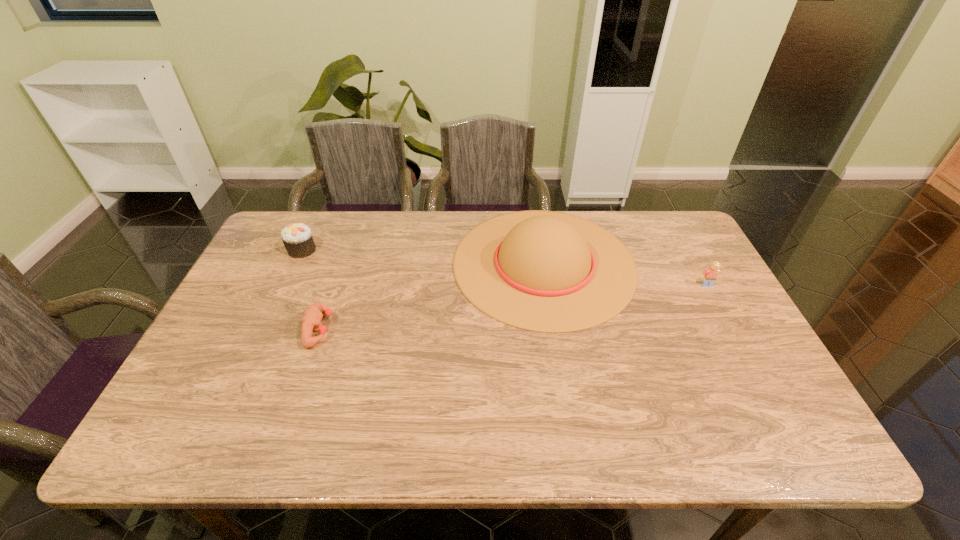
You are a GUI agent. You are given a task and a screenshot of the screen. Output one action in this format:
    pyautogui.click(x=<x>, y=<y>)
    Task: Click on the sombrero at the far edge
    
    Given the screenshot: What is the action you would take?
    pyautogui.click(x=544, y=271)

You are a GUI agent. You are given a task and a screenshot of the screen. Output one action in this format:
    pyautogui.click(x=<x>, y=<y>)
    Task: Click on the cupcake located in the far edge section of the desktop
    
    Given the screenshot: What is the action you would take?
    pyautogui.click(x=297, y=238)

I want to click on object located in the left edge section of the desktop, so click(x=297, y=238).

Where is `object that is positioned at the right edge`? Image resolution: width=960 pixels, height=540 pixels. object that is positioned at the right edge is located at coordinates (709, 276).

At what (x,y) coordinates should I click in order to perform the action: click on object located in the far left corner section of the desktop. Please return your answer as a coordinate pair (x, y). Looking at the image, I should click on (297, 238).

The width and height of the screenshot is (960, 540). In the image, there is a desktop. Find the location of `vacant space at the far edge`. vacant space at the far edge is located at coordinates (420, 222).

Find the location of a particular element. vacant space at the near edge is located at coordinates (550, 446).

At what (x,y) coordinates should I click in order to perform the action: click on blank space at the left edge of the desktop. Please return your answer as a coordinate pair (x, y). Looking at the image, I should click on (269, 288).

At what (x,y) coordinates should I click in order to perform the action: click on vacant region at the right edge of the desktop. Please return your answer as a coordinate pair (x, y). Looking at the image, I should click on 694,273.

This screenshot has width=960, height=540. In the image, there is a desktop. What are the coordinates of `vacant space at the far right corner` in the screenshot? It's located at (703, 252).